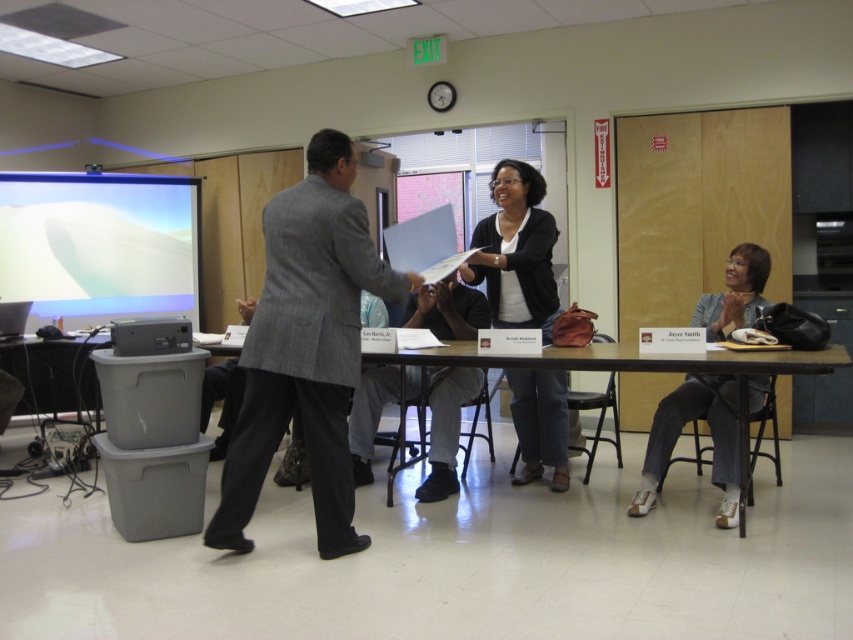
You are organizing a small event and need to place a 2ft wide decorative item on the table. Given the current setup, can the wooden table at center accommodate the item without overlapping the denim jeans at lower right?

The wooden table at center has more space than the denim jeans at lower right since it occupies less space. Therefore, the 2ft wide decorative item can be placed on the wooden table at center without overlapping the denim jeans at lower right.

You are a photographer taking a picture of the conference room scene. You want to focus on the point that is closer to the camera. Which point should you choose between point (534, 192) and point (579, 362)?

Point (579, 362) is closer to the camera than point (534, 192), so you should focus on point (579, 362).